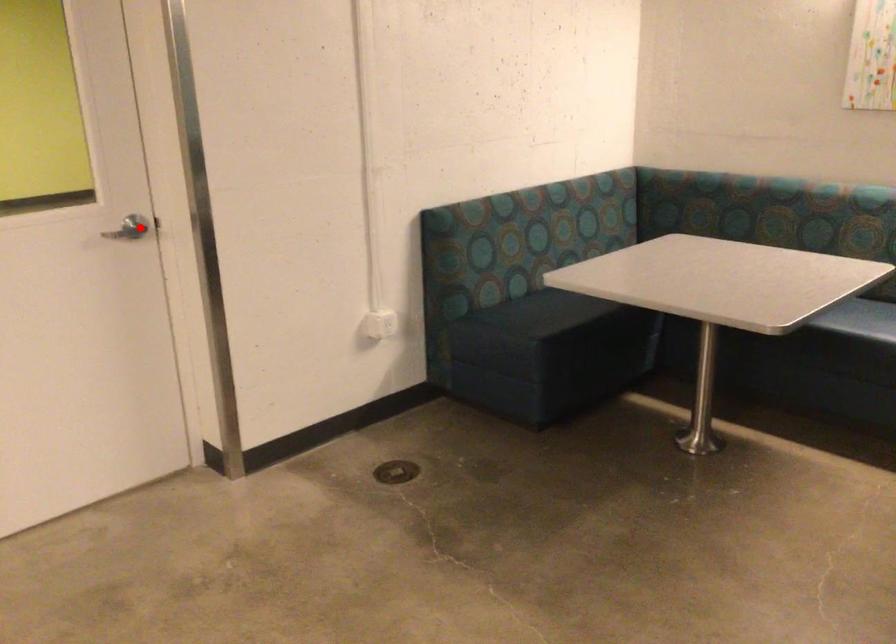
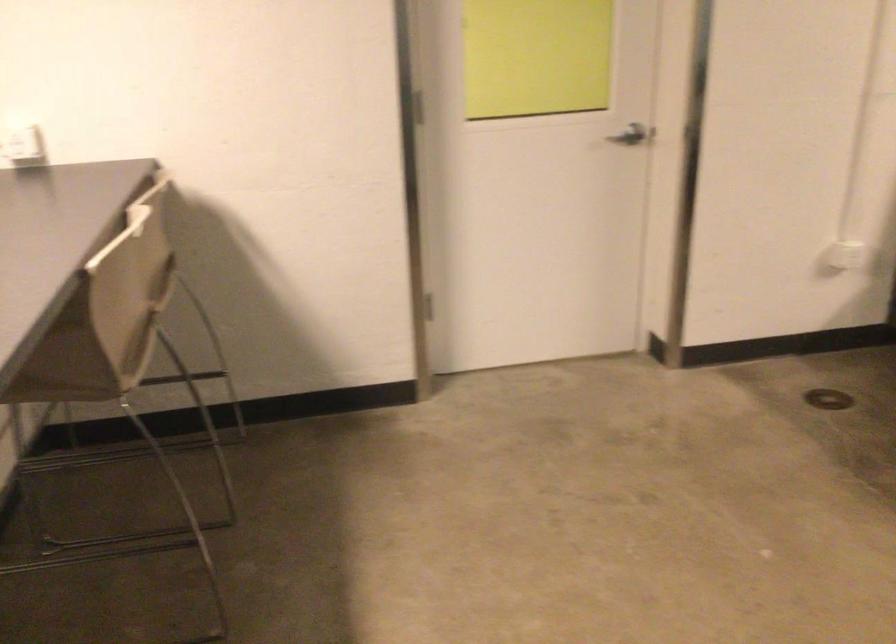
Question: I am providing you with two images of the same scene from different viewpoints. Given a red point in image1, look at the same physical point in image2. Is it:

Choices:
 (A) Closer to the viewpoint
 (B) Farther from the viewpoint

Answer: (B)